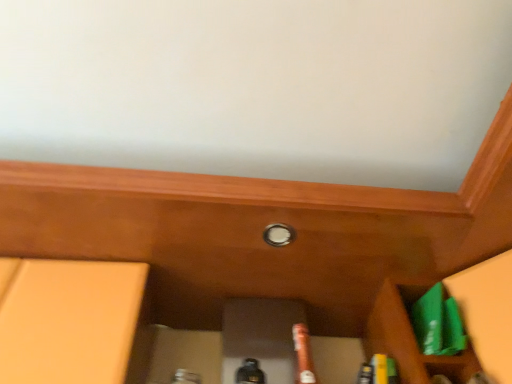
Measure the distance between green plastic bag at lower right and camera.

green plastic bag at lower right is 36.06 inches away from camera.

Measure the distance between point (x=307, y=375) and camera.

37.83 inches.

Describe the element at coordinates (303, 354) in the screenshot. This screenshot has width=512, height=384. I see `brown matte beer bottle at center` at that location.

What do you see at coordinates (278, 235) in the screenshot?
I see `white glossy knob at center` at bounding box center [278, 235].

At what (x,y) coordinates should I click in order to perform the action: click on green plastic bag at lower right. Please return your answer as a coordinate pair (x, y). Looking at the image, I should click on (410, 340).

How different are the orientations of brown matte beer bottle at center and green plastic bag at lower right in degrees?

The angular difference between brown matte beer bottle at center and green plastic bag at lower right is 0.000129 degrees.

Does point (303, 354) come in front of point (477, 359)?

No, it is not.

Measure the distance from brown matte beer bottle at center to green plastic bag at lower right.

brown matte beer bottle at center is 9.29 inches away from green plastic bag at lower right.

Does brown matte beer bottle at center appear on the left side of green plastic bag at lower right?

Yes, brown matte beer bottle at center is to the left of green plastic bag at lower right.

Is green plastic bag at lower right smaller than brown matte beer bottle at center?

Yes, green plastic bag at lower right is smaller than brown matte beer bottle at center.

I want to click on cabinetry above the brown matte beer bottle at center (from the image's perspective), so click(410, 340).

Which is closer, (464, 378) or (306, 342)?

Point (464, 378)

Which of these two, green plastic bag at lower right or brown matte beer bottle at center, is wider?

green plastic bag at lower right is wider.

Between brown matte beer bottle at center and white glossy knob at center, which one appears on the left side from the viewer's perspective?

white glossy knob at center is more to the left.

From the image's perspective, would you say brown matte beer bottle at center is positioned over white glossy knob at center?

Actually, brown matte beer bottle at center appears below white glossy knob at center in the image.

Does point (295, 347) come in front of point (287, 234)?

That is False.

How many degrees apart are the facing directions of brown matte beer bottle at center and white glossy knob at center?

They differ by 3.47e-05 degrees in their facing directions.

Is white glossy knob at center located outside green plastic bag at lower right?

Yes, white glossy knob at center is not within green plastic bag at lower right.

How different are the orientations of white glossy knob at center and green plastic bag at lower right in degrees?

white glossy knob at center and green plastic bag at lower right are facing 0.000163 degrees away from each other.

In the image, there is a white glossy knob at center. Where is `cabinetry below it (from the image's perspective)`? The width and height of the screenshot is (512, 384). cabinetry below it (from the image's perspective) is located at coordinates (410, 340).

From a real-world perspective, is white glossy knob at center on green plastic bag at lower right?

Yes, from a real-world perspective, white glossy knob at center is over green plastic bag at lower right

From the picture: Is white glossy knob at center at the right side of brown matte beer bottle at center?

Incorrect, white glossy knob at center is not on the right side of brown matte beer bottle at center.

From the picture: In terms of width, does white glossy knob at center look wider or thinner when compared to brown matte beer bottle at center?

Considering their sizes, white glossy knob at center looks slimmer than brown matte beer bottle at center.

How distant is white glossy knob at center from brown matte beer bottle at center?

They are 10.05 inches apart.

Is white glossy knob at center facing away from brown matte beer bottle at center?

No, brown matte beer bottle at center is not at the back of white glossy knob at center.

Would you say white glossy knob at center is part of green plastic bag at lower right's contents?

Actually, white glossy knob at center is outside green plastic bag at lower right.

Does green plastic bag at lower right have a lesser height compared to white glossy knob at center?

In fact, green plastic bag at lower right may be taller than white glossy knob at center.

Is green plastic bag at lower right to the left or to the right of white glossy knob at center in the image?

Clearly, green plastic bag at lower right is on the right of white glossy knob at center in the image.

Measure the distance between green plastic bag at lower right and white glossy knob at center.

They are 14.83 inches apart.

Where is `beer bottle located on the left of green plastic bag at lower right`? The image size is (512, 384). beer bottle located on the left of green plastic bag at lower right is located at coordinates (303, 354).

Where is `beer bottle below the green plastic bag at lower right (from a real-world perspective)`? This screenshot has height=384, width=512. beer bottle below the green plastic bag at lower right (from a real-world perspective) is located at coordinates (303, 354).

Which object lies nearer to the anchor point green plastic bag at lower right, brown matte beer bottle at center or white glossy knob at center?

brown matte beer bottle at center is positioned closer to the anchor green plastic bag at lower right.

Considering their positions, is green plastic bag at lower right positioned further to brown matte beer bottle at center than white glossy knob at center?

white glossy knob at center is positioned further to the anchor brown matte beer bottle at center.

Based on their spatial positions, is white glossy knob at center or brown matte beer bottle at center closer to green plastic bag at lower right?

brown matte beer bottle at center is positioned closer to the anchor green plastic bag at lower right.

Looking at the image, which one is located closer to brown matte beer bottle at center, white glossy knob at center or green plastic bag at lower right?

green plastic bag at lower right is positioned closer to the anchor brown matte beer bottle at center.

Looking at the image, which one is located closer to white glossy knob at center, brown matte beer bottle at center or green plastic bag at lower right?

The object closer to white glossy knob at center is brown matte beer bottle at center.

Considering their positions, is green plastic bag at lower right positioned further to white glossy knob at center than brown matte beer bottle at center?

Among the two, green plastic bag at lower right is located further to white glossy knob at center.

The width and height of the screenshot is (512, 384). I want to click on beer bottle between white glossy knob at center and green plastic bag at lower right, so click(303, 354).